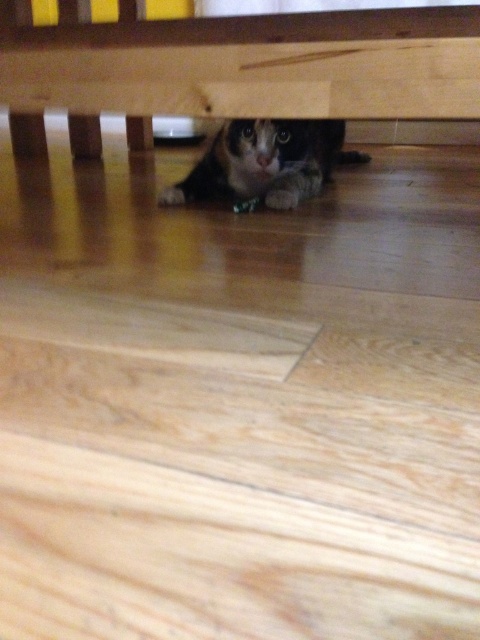
You are a pet sitter who needs to check the calico fur cat at center. The wooden table at lower center is in your way. Can you easily reach the cat without moving the table?

The wooden table at lower center is shorter than calico fur cat at center, so you can easily reach the cat without moving the table since the table is not blocking the path and is lower in height.